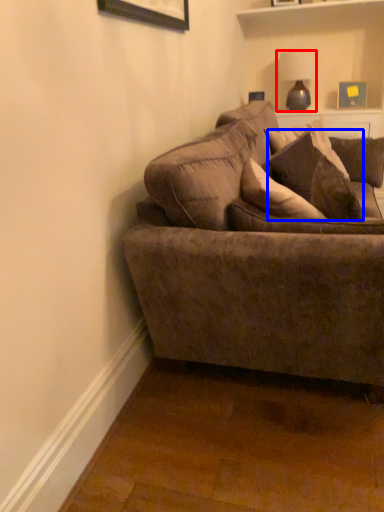
Question: Among these objects, which one is farthest to the camera, lamp (highlighted by a red box) or pillow (highlighted by a blue box)?

Choices:
 (A) lamp
 (B) pillow

Answer: (A)